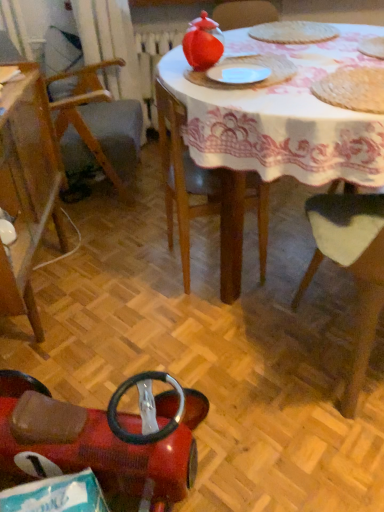
The width and height of the screenshot is (384, 512). What are the coordinates of `vacant space that's between white matte paper plate at center and woven mat at upper right, which is the 1th food from front to back` in the screenshot? It's located at (297, 87).